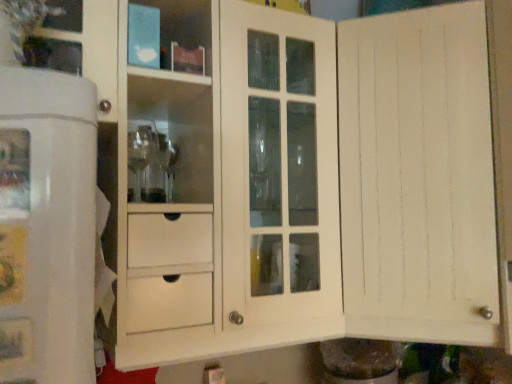
What do you see at coordinates (418, 177) in the screenshot?
I see `white matte cabinet door at right` at bounding box center [418, 177].

What are the coordinates of `white matte cabinet door at right` in the screenshot? It's located at (418, 177).

You are a GUI agent. You are given a task and a screenshot of the screen. Output one action in this format:
    pyautogui.click(x=<x>, y=<y>)
    Task: Click on the white matte cabinet door at right
    The height and width of the screenshot is (384, 512).
    Given the screenshot: What is the action you would take?
    pyautogui.click(x=418, y=177)